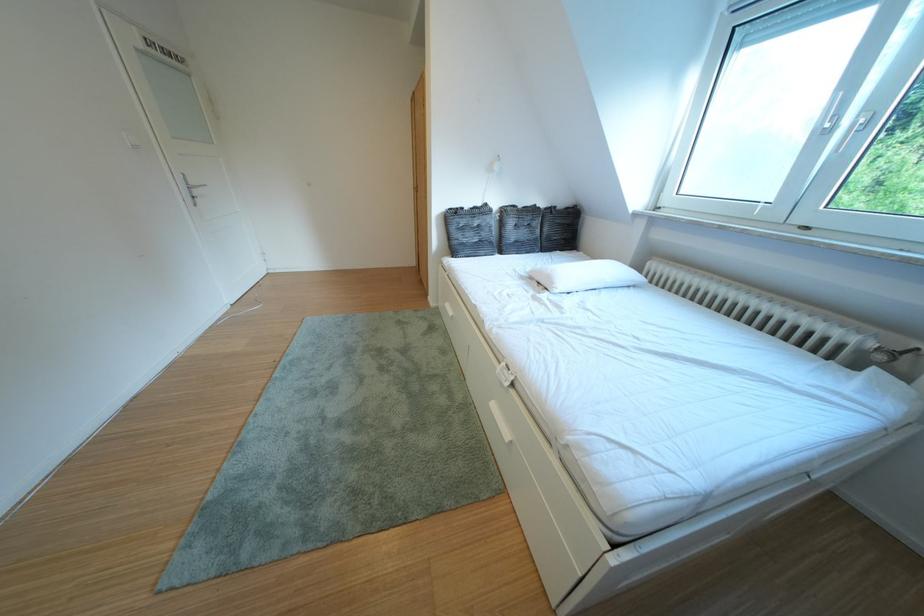
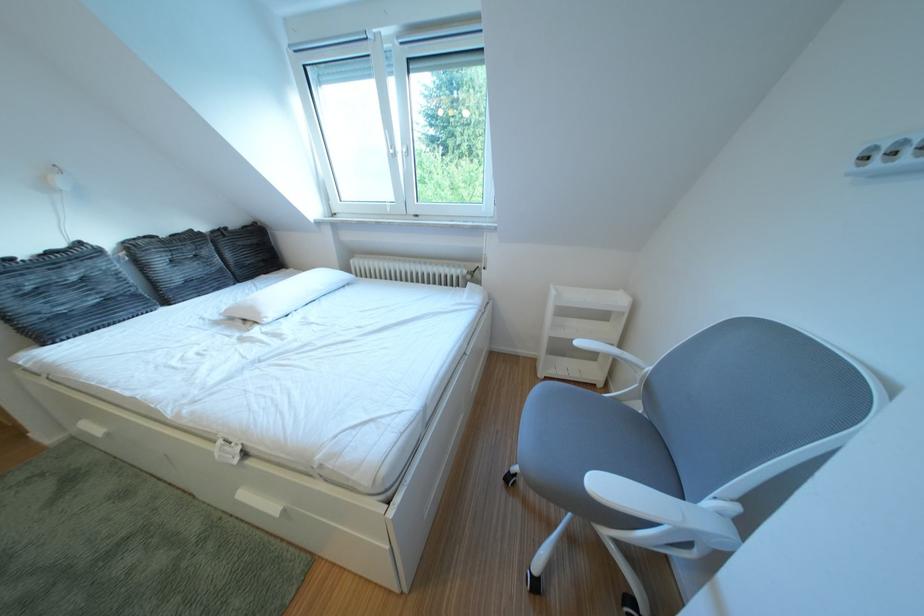
The point at (x=565, y=288) is marked in the first image. Where is the corresponding point in the second image?

(273, 318)